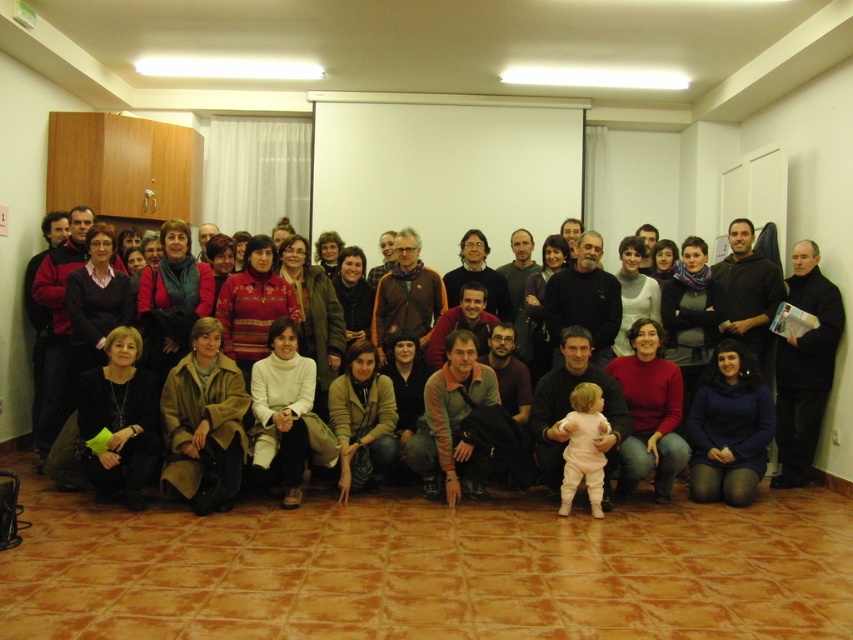
Question: Is black matte jacket at right wider than matte black jacket at lower center?

Choices:
 (A) no
 (B) yes

Answer: (B)

Question: Among these objects, which one is nearest to the camera?

Choices:
 (A) matte black jacket at lower center
 (B) black matte jacket at right

Answer: (A)

Question: Which of the following is the closest to the observer?

Choices:
 (A) (833, 273)
 (B) (843, 323)

Answer: (B)

Question: Is black matte jacket at right to the right of matte black jacket at lower center from the viewer's perspective?

Choices:
 (A) yes
 (B) no

Answer: (B)

Question: From the image, what is the correct spatial relationship of black matte jacket at right in relation to matte black jacket at lower center?

Choices:
 (A) right
 (B) left

Answer: (B)

Question: Which point appears closest to the camera in this image?

Choices:
 (A) (834, 413)
 (B) (802, 298)

Answer: (A)